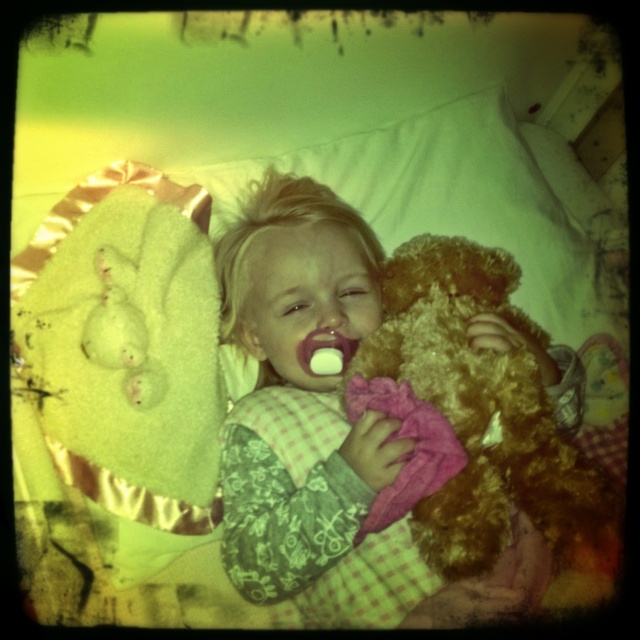
You are a photographer trying to capture a closeup of the fluffy brown teddy bear at center and the fuzzy brown teddy bear at center. Which one should you focus on to ensure it appears clearer in the photo?

The fluffy brown teddy bear at center is further to the viewer than fuzzy brown teddy bear at center, so focusing on the fluffy brown teddy bear at center will make it appear clearer in the photo.

You are a parent trying to choose a bear for your child to sleep with. You have the fuzzy brown teddy bear at center and the white plush bear at upper left. Which one is bigger?

The fuzzy brown teddy bear at center is larger than the white plush bear at upper left.